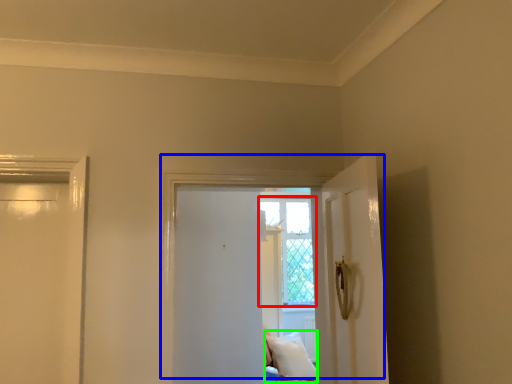
Question: Considering the real-world distances, which object is farthest from window (highlighted by a red box)? door (highlighted by a blue box) or pillow (highlighted by a green box)?

Choices:
 (A) door
 (B) pillow

Answer: (A)